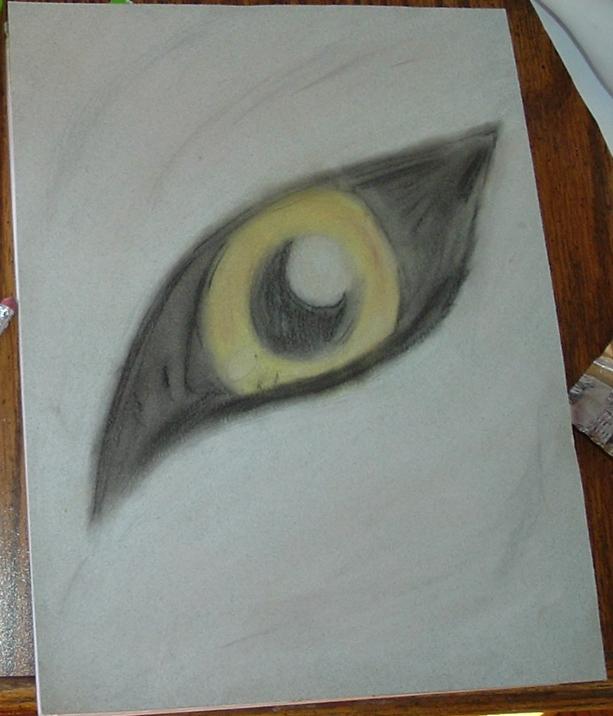
Where is `wood grain`? The height and width of the screenshot is (716, 613). wood grain is located at coordinates (601, 208), (588, 316), (563, 105).